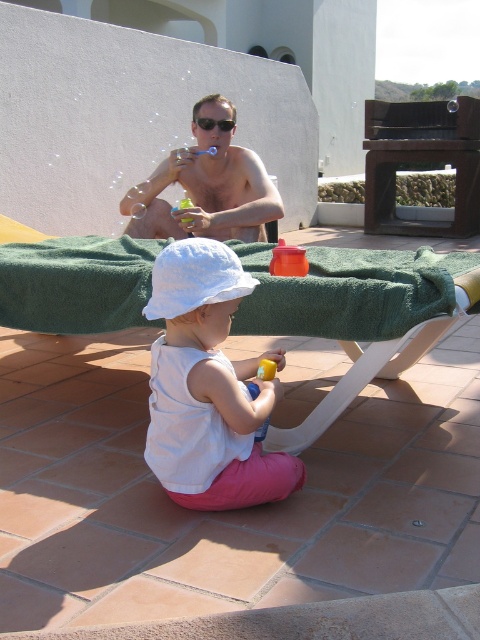
Consider the image. Can you confirm if white cotton hat at center is taller than matte plastic cup at upper center?

In fact, white cotton hat at center may be shorter than matte plastic cup at upper center.

Who is higher up, white cotton hat at center or matte plastic cup at upper center?

matte plastic cup at upper center is higher up.

Who is more distant from viewer, (x=256, y=464) or (x=211, y=227)?

Positioned behind is point (x=211, y=227).

At what (x,y) coordinates should I click in order to perform the action: click on white cotton hat at center. Please return your answer as a coordinate pair (x, y). Looking at the image, I should click on (207, 387).

Describe the element at coordinates (348, 291) in the screenshot. I see `green fuzzy bath towel at center` at that location.

Consider the image. Is green fuzzy bath towel at center shorter than sunglasses at upper center?

No, green fuzzy bath towel at center is not shorter than sunglasses at upper center.

Does point (259, 323) come in front of point (216, 124)?

Yes, it is in front of point (216, 124).

Locate an element on the screen. This screenshot has width=480, height=640. green fuzzy bath towel at center is located at coordinates (348, 291).

Who is lower down, white cotton hat at center or sunglasses at upper center?

Positioned lower is white cotton hat at center.

Can you confirm if white cotton hat at center is positioned below sunglasses at upper center?

Indeed, white cotton hat at center is positioned under sunglasses at upper center.

Is point (180, 467) positioned before point (211, 125)?

Yes, point (180, 467) is closer to viewer.

At what (x,y) coordinates should I click in order to perform the action: click on white cotton hat at center. Please return your answer as a coordinate pair (x, y). This screenshot has width=480, height=640. Looking at the image, I should click on (207, 387).